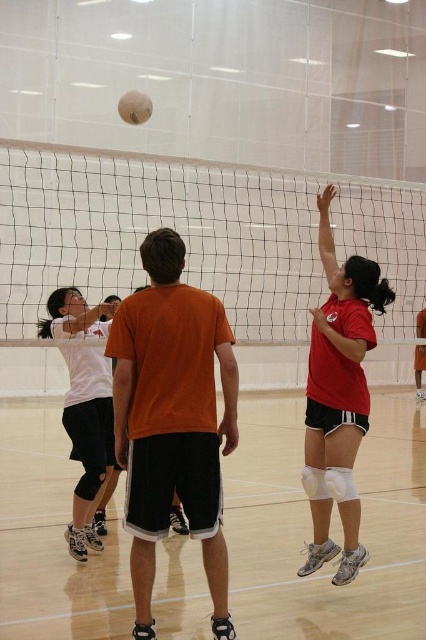
You are a volleyball player standing on the court. You need to spike the ball over the white mesh net at center without hitting the net. Considering the height difference between the net and the matte red shirt at right, can you estimate if the net is high enough for a typical spike?

The white mesh net at center is taller than the matte red shirt at right. Since the net is higher than the player wearing the matte red shirt at right, it should be sufficient for a typical spike as players usually jump higher than their standing height to spike the ball over the net.

You are a volleyball coach observing the game. You notice the white mesh net at center and the beige fabric volleyball at upper center. Which object is larger in size?

The white mesh net at center is larger than the beige fabric volleyball at upper center according to the description.

You are a volleyball coach observing the game. You need to determine if the white mesh net at center can fully cover the matte red shirt at right when viewed from above. Based on their sizes, what is your conclusion?

The white mesh net at center is wider than the matte red shirt at right, so it can fully cover the matte red shirt at right when viewed from above.